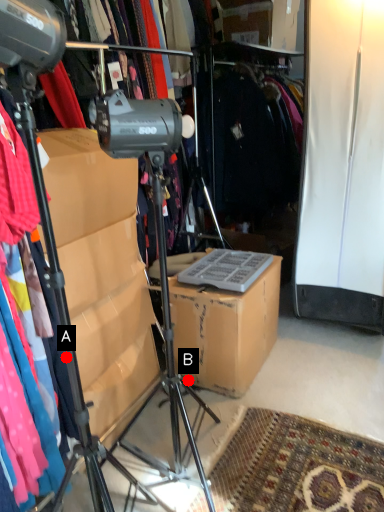
Question: Two points are circled on the image, labeled by A and B beside each circle. Among these points, which one is farthest from the camera?

Choices:
 (A) A is further
 (B) B is further

Answer: (B)